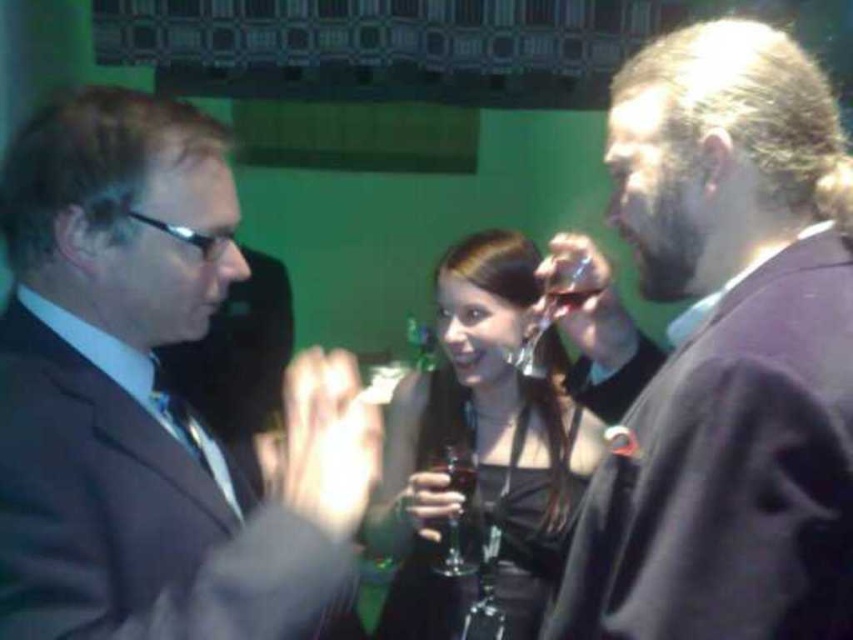
Who is shorter, satin black dress at center or clear glass wine glass at center?

With less height is clear glass wine glass at center.

Does satin black dress at center have a lesser height compared to clear glass wine glass at center?

Incorrect, satin black dress at center's height does not fall short of clear glass wine glass at center's.

Is point (553, 458) farther from camera compared to point (572, 298)?

Yes, point (553, 458) is farther from viewer.

This screenshot has height=640, width=853. Find the location of `satin black dress at center`. satin black dress at center is located at coordinates click(x=480, y=451).

Does point (57, 152) come behind point (466, 497)?

No, (57, 152) is in front of (466, 497).

Is point (45, 122) in front of point (463, 515)?

Yes, point (45, 122) is closer to viewer.

Who is more forward, (155, 272) or (463, 449)?

Point (155, 272) is in front.

Where is `matte black suit at left`? matte black suit at left is located at coordinates (151, 397).

Which of these two, matte black suit at left or clear glass wine glass at center, stands taller?

matte black suit at left is taller.

Who is higher up, matte black suit at left or clear glass wine glass at center?

Positioned higher is clear glass wine glass at center.

Looking at this image, who is more forward, (16, 250) or (590, 292)?

Point (16, 250) is more forward.

This screenshot has width=853, height=640. I want to click on matte black suit at left, so click(x=151, y=397).